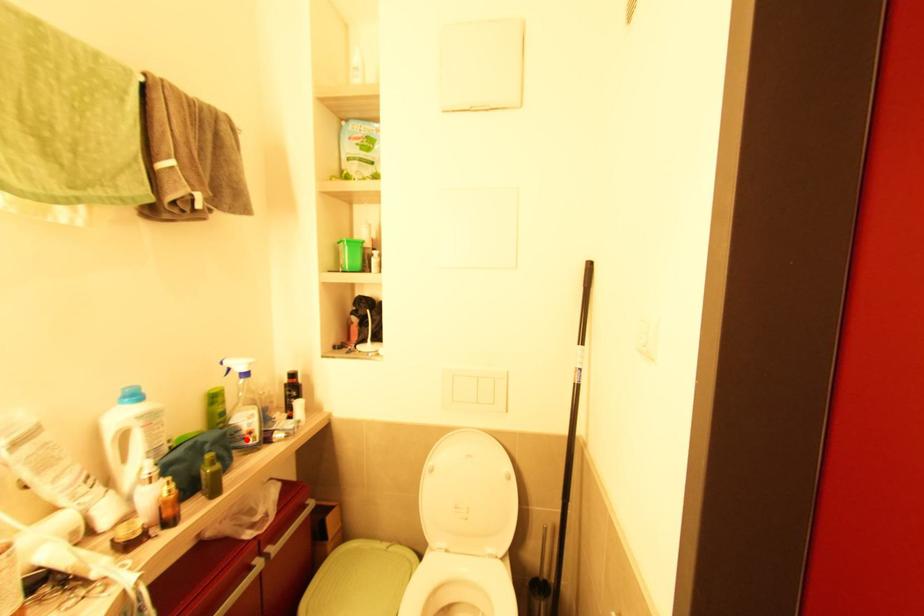
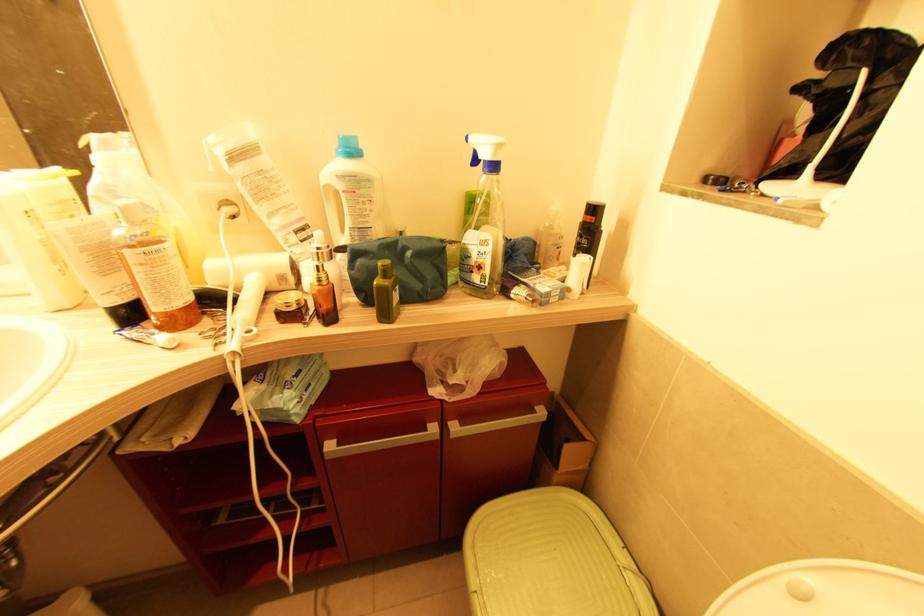
Locate, in the second image, the point that corresponds to the highlighted location in the first image.

(473, 273)